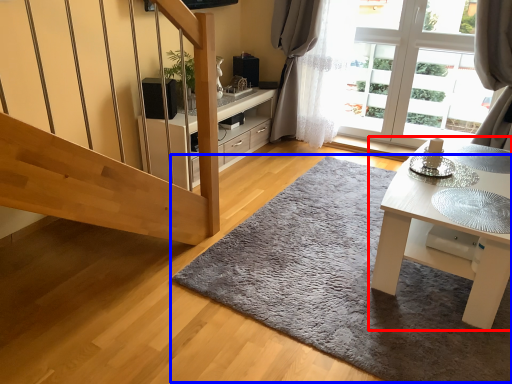
Question: Which object appears farthest to the camera in this image, table (highlighted by a red box) or doormat (highlighted by a blue box)?

Choices:
 (A) table
 (B) doormat

Answer: (A)